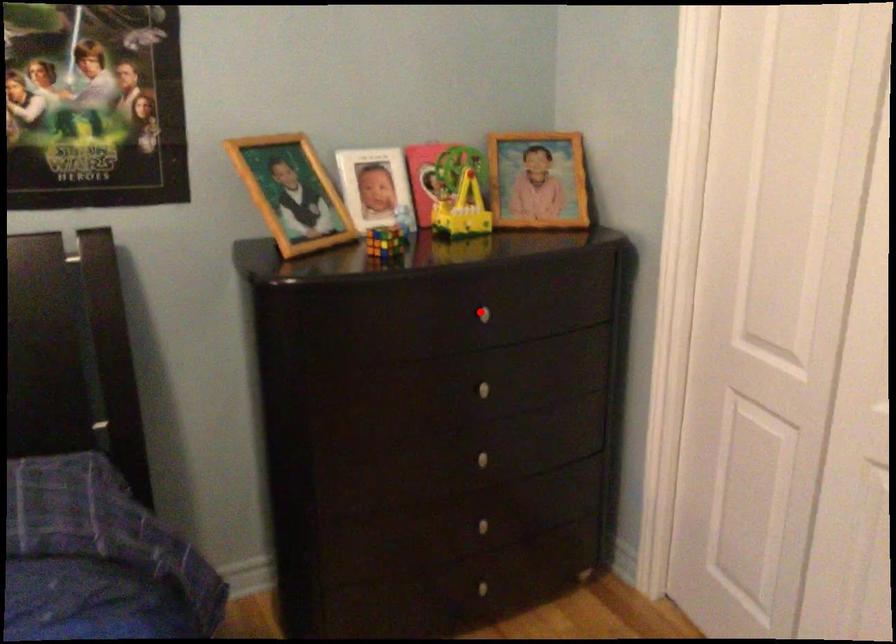
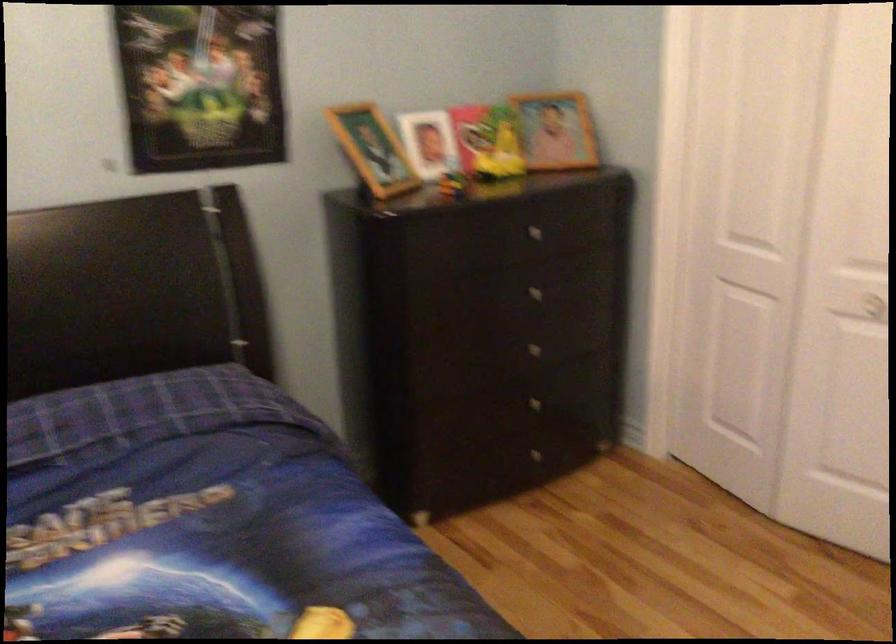
Question: A red point is marked in image1. In image2, is the corresponding 3D point closer to the camera or farther? Reply with the corresponding letter.

Choices:
 (A) The corresponding 3D point is closer.
 (B) The corresponding 3D point is farther.

Answer: (B)